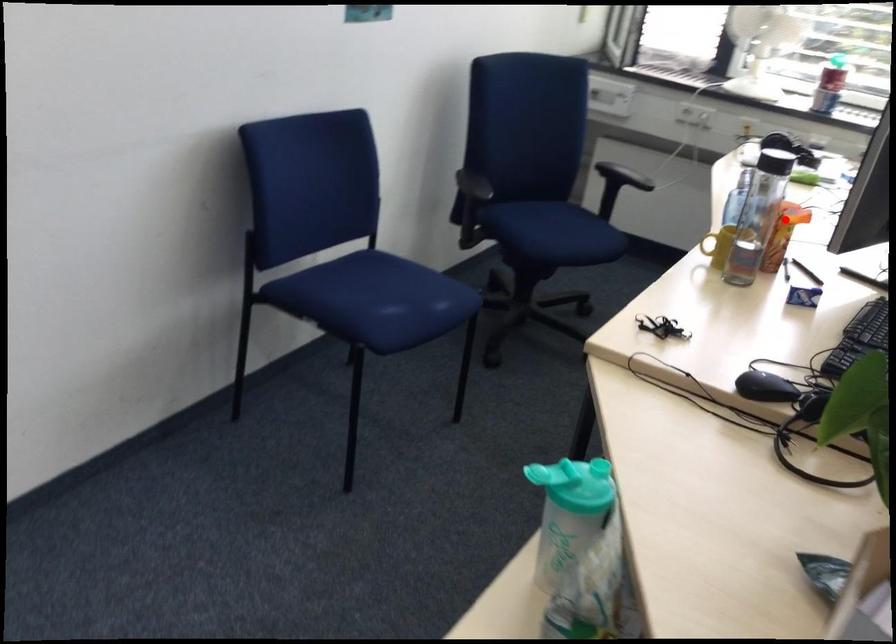
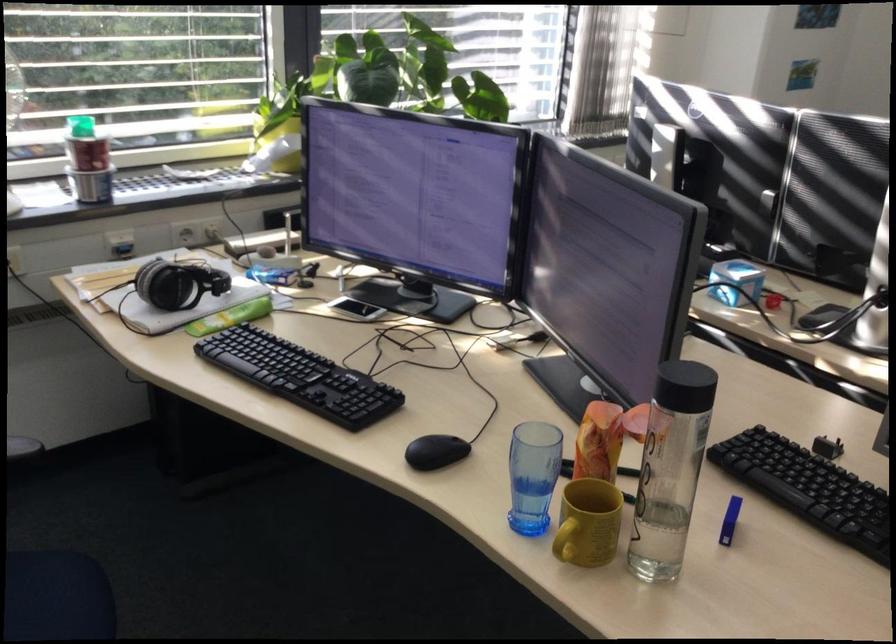
Question: I am providing you with two images of the same scene from different viewpoints. Image1 has a red point marked. In image2, the corresponding 3D location appears at what relative position? Reply with the corresponding letter.

Choices:
 (A) Closer
 (B) Farther

Answer: (A)